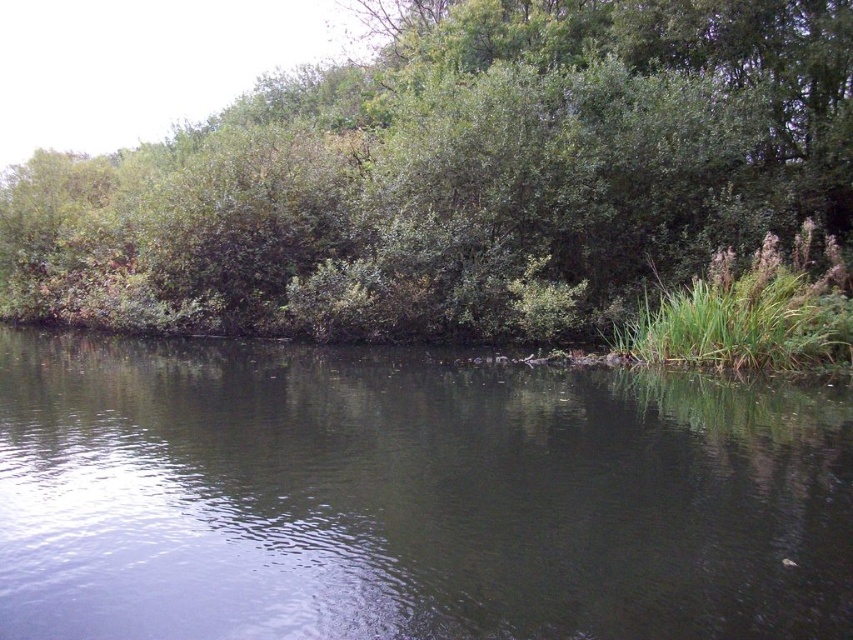
You are standing at the point closest to the viewer in the scene. Which point, point (x=692, y=513) or point (x=344, y=291), is closer to you?

Point (x=692, y=513) is closer to you because it is in front of point (x=344, y=291).